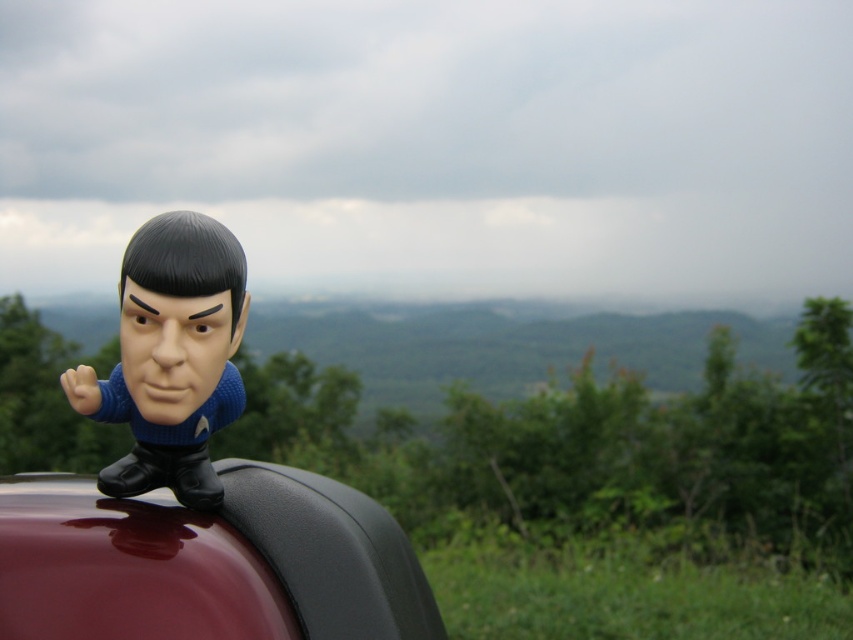
Question: Which of the following is the farthest from the observer?

Choices:
 (A) glossy black car at upper center
 (B) matte black bobblehead at upper left

Answer: (A)

Question: Considering the relative positions of glossy black car at upper center and matte black bobblehead at upper left in the image provided, where is glossy black car at upper center located with respect to matte black bobblehead at upper left?

Choices:
 (A) above
 (B) below

Answer: (B)

Question: Which point is closer to the camera?

Choices:
 (A) (175, 312)
 (B) (39, 557)

Answer: (A)

Question: Does glossy black car at upper center appear on the right side of matte black bobblehead at upper left?

Choices:
 (A) no
 (B) yes

Answer: (A)

Question: Is glossy black car at upper center to the left of matte black bobblehead at upper left from the viewer's perspective?

Choices:
 (A) yes
 (B) no

Answer: (A)